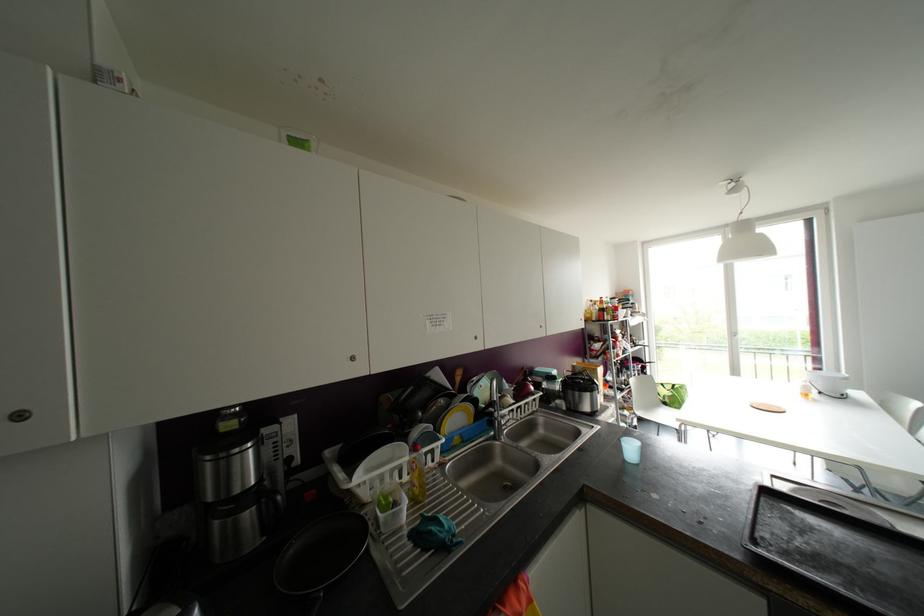
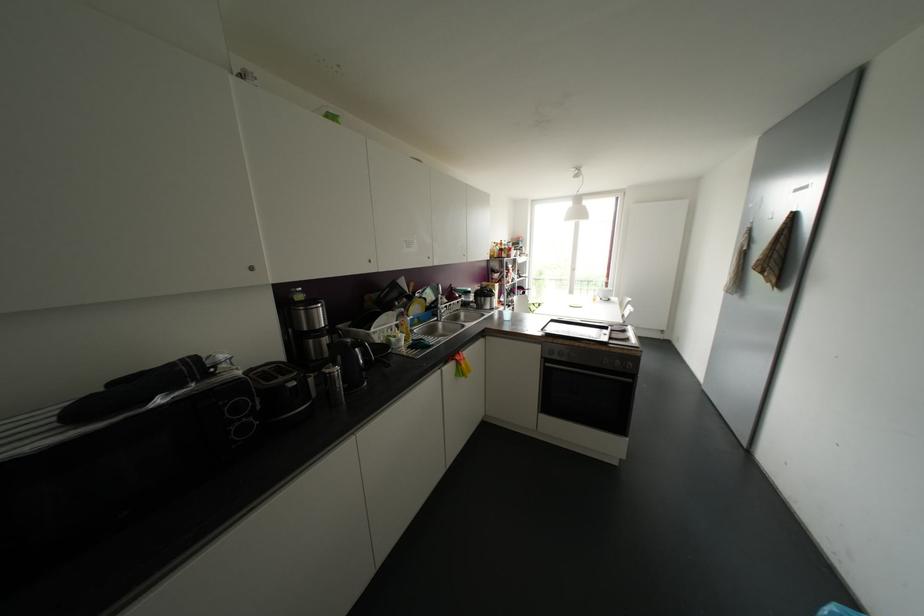
Looking at this image, which direction would the cameraman need to move to produce the second image?

The movement direction of the cameraman is left, backward.